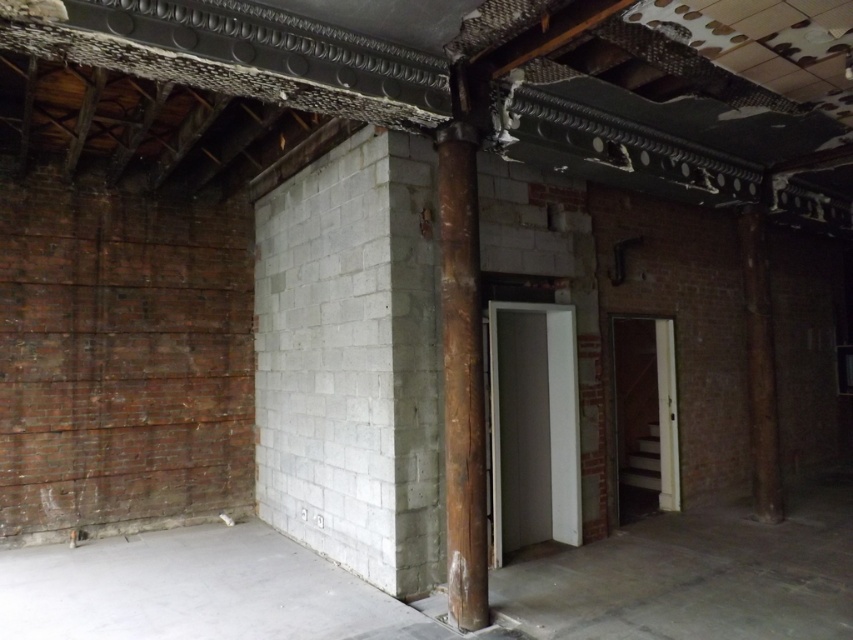
Question: Observing the image, what is the correct spatial positioning of rusty wood pillar at center in reference to brown wood pillar at right?

Choices:
 (A) right
 (B) left

Answer: (B)

Question: Does rusty wood pillar at center appear on the right side of brown wood pillar at right?

Choices:
 (A) yes
 (B) no

Answer: (B)

Question: Among these points, which one is nearest to the camera?

Choices:
 (A) (463, 563)
 (B) (741, 225)

Answer: (A)

Question: Can you confirm if rusty wood pillar at center is positioned below brown wood pillar at right?

Choices:
 (A) yes
 (B) no

Answer: (B)

Question: Which of the following is the farthest from the observer?

Choices:
 (A) (749, 394)
 (B) (477, 291)

Answer: (A)